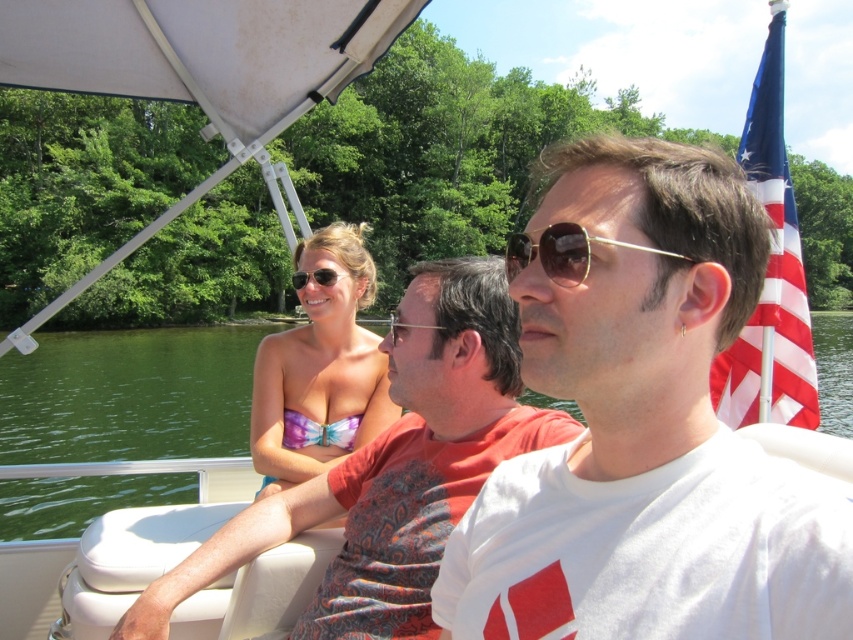
Is point (416, 392) closer to camera compared to point (570, 272)?

No, (416, 392) is further to viewer.

Find the location of `matte white t-shirt at center`. matte white t-shirt at center is located at coordinates (393, 467).

What do you see at coordinates (393, 467) in the screenshot? I see `matte white t-shirt at center` at bounding box center [393, 467].

Where is `matte white t-shirt at center`? This screenshot has width=853, height=640. matte white t-shirt at center is located at coordinates (393, 467).

Is point (697, 268) less distant than point (419, 276)?

Yes.

Which is below, white cotton t-shirt at center or matte white t-shirt at center?

matte white t-shirt at center is lower down.

What do you see at coordinates (642, 426) in the screenshot? This screenshot has height=640, width=853. I see `white cotton t-shirt at center` at bounding box center [642, 426].

At what (x,y) coordinates should I click in order to perform the action: click on white cotton t-shirt at center. Please return your answer as a coordinate pair (x, y). Looking at the image, I should click on (642, 426).

Does matte white t-shirt at center have a greater width compared to green water at center?

In fact, matte white t-shirt at center might be narrower than green water at center.

Is matte white t-shirt at center smaller than green water at center?

Indeed, matte white t-shirt at center has a smaller size compared to green water at center.

Does point (254, 513) come farther from viewer compared to point (57, 433)?

No, it is in front of (57, 433).

The image size is (853, 640). Identify the location of matte white t-shirt at center. (393, 467).